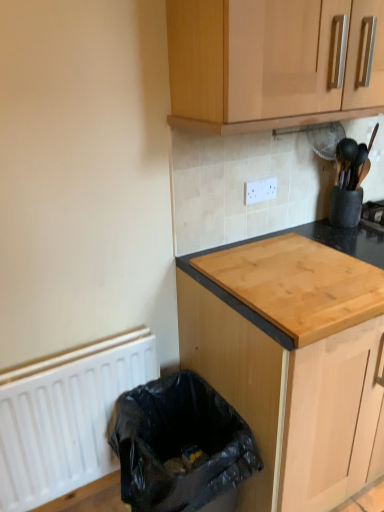
This screenshot has height=512, width=384. Identify the location of free space above white matte radiator at lower left (from a real-world perspective). (41, 362).